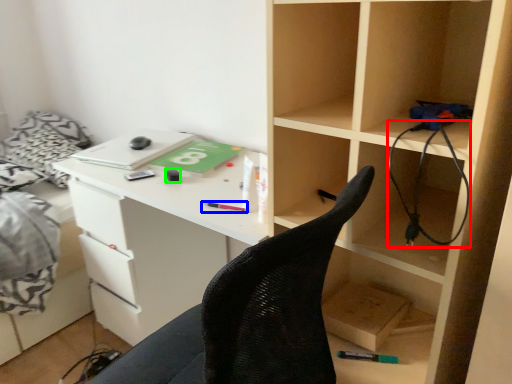
Question: Estimate the real-world distances between objects in this image. Which object is farther from wire (highlighted by a red box), stationery (highlighted by a blue box) or stationery (highlighted by a green box)?

Choices:
 (A) stationery
 (B) stationery

Answer: (B)